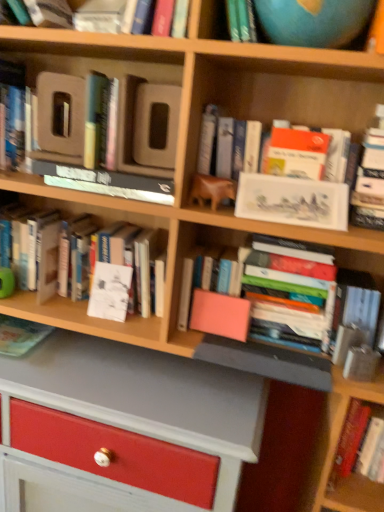
Question: Is hardcover book at lower right, the 1th book positioned from the bottom, not within matte green book at lower left, positioned as the 2th book in bottom-to-top order?

Choices:
 (A) no
 (B) yes

Answer: (B)

Question: Is hardcover book at lower right, the 1th book positioned from the bottom, surrounding matte green book at lower left, positioned as the 2th book in bottom-to-top order?

Choices:
 (A) yes
 (B) no

Answer: (B)

Question: Can you confirm if hardcover book at lower right, the 1th book positioned from the bottom, is taller than matte green book at lower left, the fifth book in the top-to-bottom sequence?

Choices:
 (A) no
 (B) yes

Answer: (B)

Question: Considering the relative positions of hardcover book at lower right, the 1th book positioned from the bottom, and matte green book at lower left, the fifth book in the top-to-bottom sequence, in the image provided, is hardcover book at lower right, the 1th book positioned from the bottom, behind matte green book at lower left, the fifth book in the top-to-bottom sequence,?

Choices:
 (A) yes
 (B) no

Answer: (B)

Question: Can you confirm if hardcover book at lower right, the 1th book positioned from the bottom, is positioned to the left of matte green book at lower left, the fifth book in the top-to-bottom sequence?

Choices:
 (A) no
 (B) yes

Answer: (A)

Question: Is hardcover book at lower right, which is counted as the 6th book, starting from the top, thinner than matte green book at lower left, the fifth book in the top-to-bottom sequence?

Choices:
 (A) no
 (B) yes

Answer: (B)

Question: Can you confirm if pink matte book at center, positioned as the second paperback book in front-to-back order, is wider than blue matte globe at upper right?

Choices:
 (A) yes
 (B) no

Answer: (B)

Question: Does pink matte book at center, marked as the 3th paperback book in a top-to-bottom arrangement, come in front of blue matte globe at upper right?

Choices:
 (A) yes
 (B) no

Answer: (B)

Question: From the image's perspective, is pink matte book at center, which is the second paperback book in back-to-front order, above blue matte globe at upper right?

Choices:
 (A) no
 (B) yes

Answer: (A)

Question: Considering the relative sizes of pink matte book at center, marked as the 3th paperback book in a top-to-bottom arrangement, and blue matte globe at upper right in the image provided, is pink matte book at center, marked as the 3th paperback book in a top-to-bottom arrangement, thinner than blue matte globe at upper right?

Choices:
 (A) yes
 (B) no

Answer: (A)

Question: From a real-world perspective, is pink matte book at center, which is the 1th paperback book from bottom to top, over blue matte globe at upper right?

Choices:
 (A) no
 (B) yes

Answer: (A)

Question: Is there a large distance between pink matte book at center, which is the second paperback book in back-to-front order, and blue matte globe at upper right?

Choices:
 (A) no
 (B) yes

Answer: (A)

Question: From the image's perspective, is hardcover book at lower right, the 1th book positioned from the bottom, over white paper at center, arranged as the 1th paperback book when viewed from the left?

Choices:
 (A) yes
 (B) no

Answer: (B)